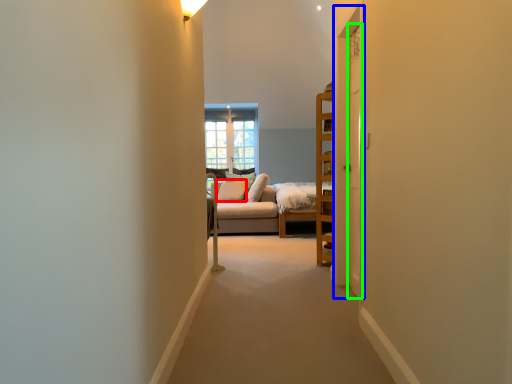
Question: Which is farther away from pillow (highlighted by a red box)? door (highlighted by a blue box) or door (highlighted by a green box)?

Choices:
 (A) door
 (B) door

Answer: (B)